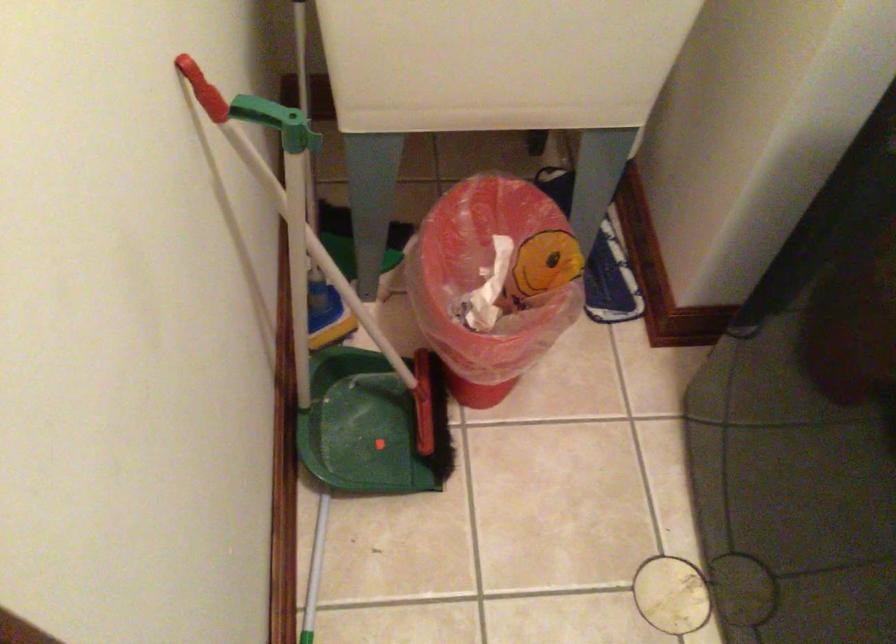
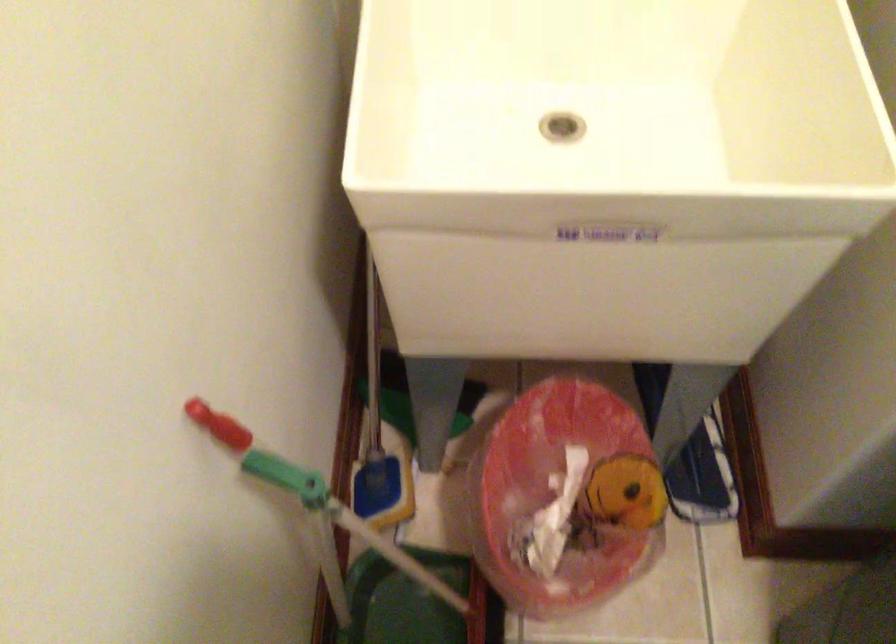
Where in the second image is the point corresponding to (204,91) from the first image?

(220, 426)